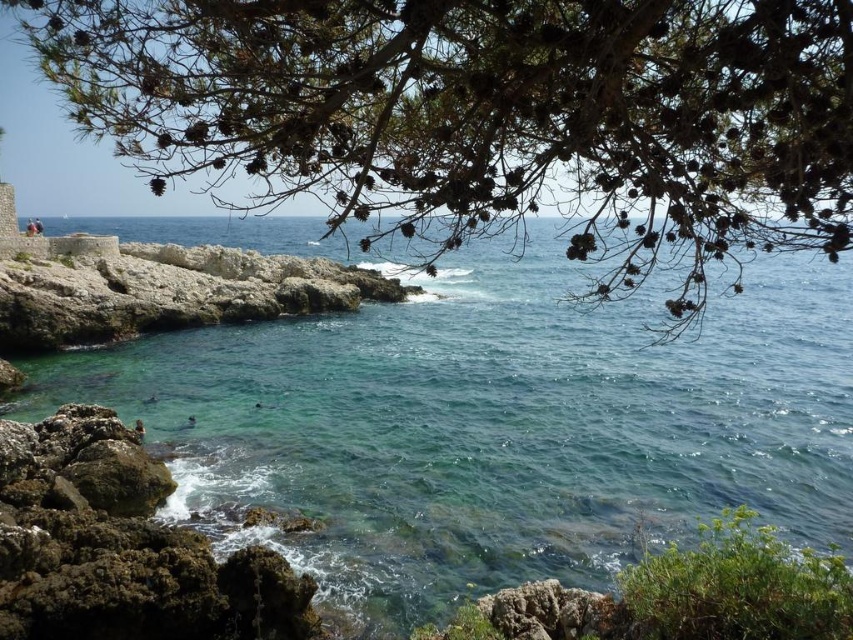
You are a painter setting up an easel to paint the coastal scene. You want to ensure the green textured pine branches at upper center and the rough stone wall at left are both visible in your painting. Based on their heights, which object should you place higher on the canvas?

The rough stone wall at left should be placed higher on the canvas since it is taller than the green textured pine branches at upper center.

From the picture: You are standing at the edge of the cliff overlooking the ocean. You see the green textured pine branches at upper center and the green mossy rock at lower left. Which object is closer to you?

The green textured pine branches at upper center are closer to you than the green mossy rock at lower left.